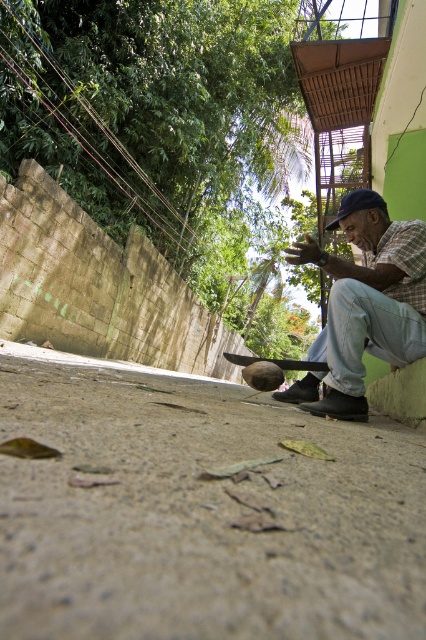
In the scene shown: You are a photographer standing at the edge of the gray concrete pavement at lower center. You want to take a photo of the dark blue fabric baseball cap at center without it being blocked by anything. Is the cap visible from your current position?

The gray concrete pavement at lower center is taller than the dark blue fabric baseball cap at center, so the cap might be blocked by the pavement if you are standing on it. Move to a higher position to ensure visibility.

You are a photographer trying to capture a candid shot of the man sitting on the building wall. You notice the gray concrete pavement at lower center and the dark blue fabric baseball cap at center. Which object is positioned lower in the image?

The gray concrete pavement at lower center is positioned lower than the dark blue fabric baseball cap at center in the image.